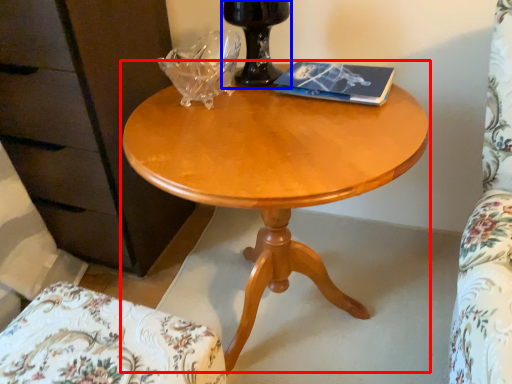
Question: Among these objects, which one is nearest to the camera, coffee table (highlighted by a red box) or glass vase (highlighted by a blue box)?

Choices:
 (A) coffee table
 (B) glass vase

Answer: (A)